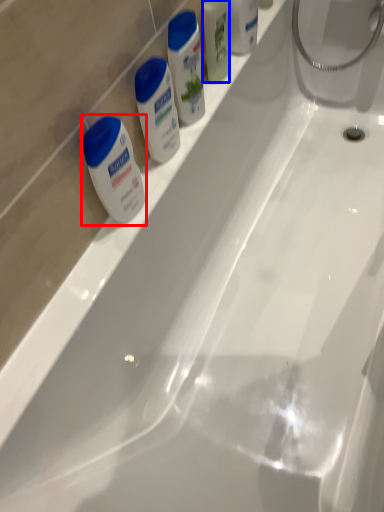
Question: Which point is closer to the camera, shaving cream (highlighted by a red box) or mouthwash (highlighted by a blue box)?

Choices:
 (A) shaving cream
 (B) mouthwash

Answer: (A)